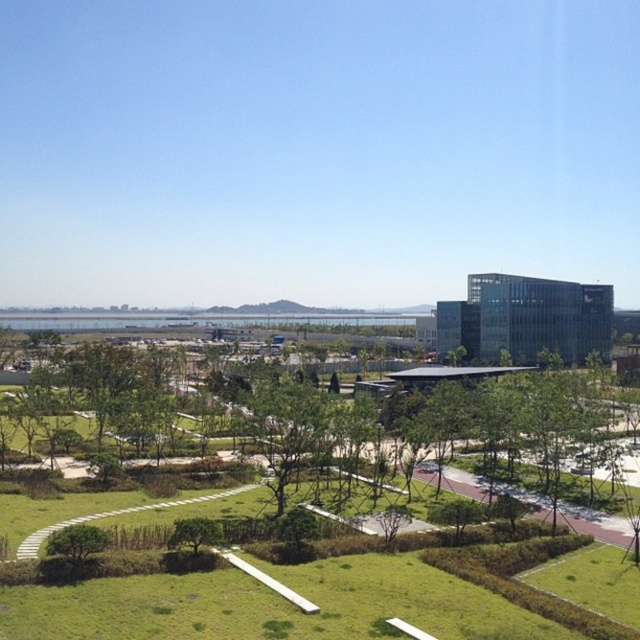
Based on the photo, can you confirm if green grassy park at center is taller than green leafy tree at lower center?

Yes.

Does green grassy park at center appear on the right side of green leafy tree at lower center?

Yes, green grassy park at center is to the right of green leafy tree at lower center.

This screenshot has height=640, width=640. In order to click on green grassy park at center in this screenshot , I will do `click(144, 612)`.

At what (x,y) coordinates should I click in order to perform the action: click on green grassy park at center. Please return your answer as a coordinate pair (x, y). The image size is (640, 640). Looking at the image, I should click on (144, 612).

Locate an element on the screen. green leafy tree at lower left is located at coordinates (76, 541).

Consider the image. Measure the distance between point (49, 556) and camera.

Point (49, 556) is 120.65 feet away from camera.

Describe the element at coordinates (76, 541) in the screenshot. I see `green leafy tree at lower left` at that location.

Identify the location of green leafy tree at lower left. The width and height of the screenshot is (640, 640). (76, 541).

Is green grassy park at center bigger than green leafy tree at lower left?

Indeed, green grassy park at center has a larger size compared to green leafy tree at lower left.

Which is more to the right, green grassy park at center or green leafy tree at lower left?

From the viewer's perspective, green grassy park at center appears more on the right side.

Is point (241, 608) farther from viewer compared to point (67, 544)?

That is False.

Locate an element on the screen. This screenshot has width=640, height=640. green grassy park at center is located at coordinates (144, 612).